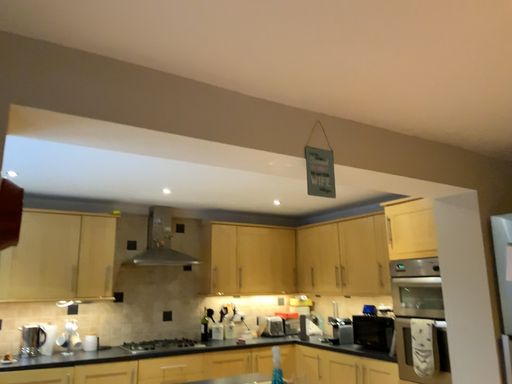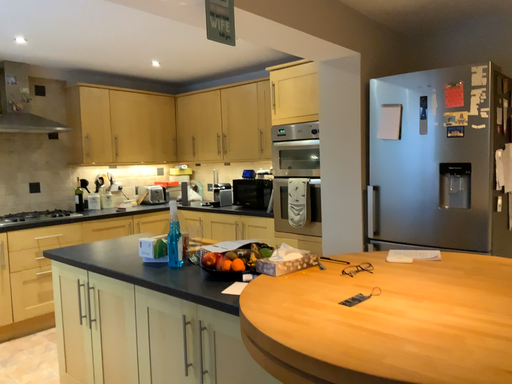
Question: Which way did the camera rotate in the video?

Choices:
 (A) rotated right
 (B) rotated left

Answer: (A)